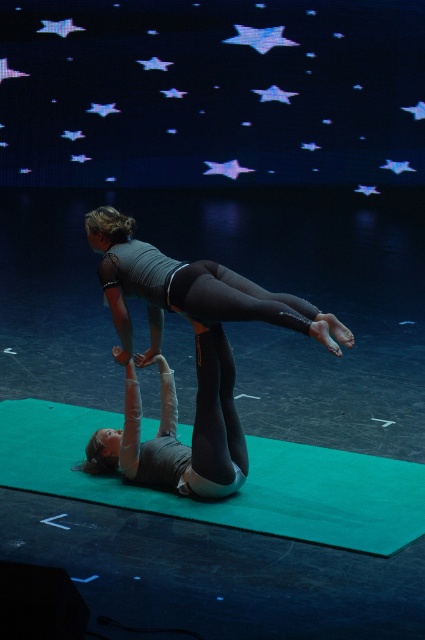
Question: Does green rubber yoga mat at center have a lesser width compared to matte black gymnast at upper center?

Choices:
 (A) no
 (B) yes

Answer: (A)

Question: Observing the image, what is the correct spatial positioning of green rubber yoga mat at center in reference to matte black gymnast at upper center?

Choices:
 (A) left
 (B) right

Answer: (A)

Question: Is green rubber yoga mat at center below matte black gymnast at upper center?

Choices:
 (A) no
 (B) yes

Answer: (B)